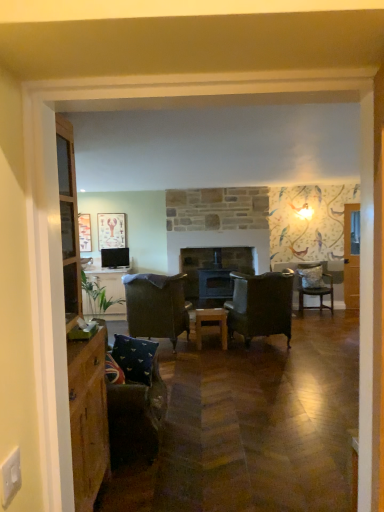
Question: Does wooden stove at center appear on the left side of blue fabric pillow at lower left?

Choices:
 (A) yes
 (B) no

Answer: (B)

Question: From the image's perspective, is wooden stove at center above blue fabric pillow at lower left?

Choices:
 (A) no
 (B) yes

Answer: (B)

Question: Is wooden stove at center in contact with blue fabric pillow at lower left?

Choices:
 (A) yes
 (B) no

Answer: (B)

Question: Is wooden stove at center far from blue fabric pillow at lower left?

Choices:
 (A) yes
 (B) no

Answer: (A)

Question: Is wooden stove at center positioned beyond the bounds of blue fabric pillow at lower left?

Choices:
 (A) no
 (B) yes

Answer: (B)

Question: Would you say velvet dark brown armchair at center, the second chair viewed from the front, is to the left or to the right of wooden stove at center in the picture?

Choices:
 (A) left
 (B) right

Answer: (A)

Question: From their relative heights in the image, would you say velvet dark brown armchair at center, which appears as the 3th chair when viewed from the right, is taller or shorter than wooden stove at center?

Choices:
 (A) short
 (B) tall

Answer: (A)

Question: Considering the positions of velvet dark brown armchair at center, which appears as the 3th chair when viewed from the right, and wooden stove at center in the image, is velvet dark brown armchair at center, which appears as the 3th chair when viewed from the right, bigger or smaller than wooden stove at center?

Choices:
 (A) big
 (B) small

Answer: (A)

Question: From a real-world perspective, is velvet dark brown armchair at center, which appears as the 3th chair when viewed from the right, positioned above or below wooden stove at center?

Choices:
 (A) above
 (B) below

Answer: (B)

Question: Is wooden table at center taller or shorter than velvet dark brown chair at right, the 3th chair when ordered from front to back?

Choices:
 (A) tall
 (B) short

Answer: (B)

Question: Is wooden table at center wider or thinner than velvet dark brown chair at right, the 3th chair when ordered from front to back?

Choices:
 (A) thin
 (B) wide

Answer: (A)

Question: From a real-world perspective, is wooden table at center positioned above or below velvet dark brown chair at right, the 3th chair when ordered from front to back?

Choices:
 (A) below
 (B) above

Answer: (A)

Question: Considering the positions of point (213, 309) and point (311, 280), is point (213, 309) closer or farther from the camera than point (311, 280)?

Choices:
 (A) farther
 (B) closer

Answer: (B)

Question: Does point (180, 304) appear closer or farther from the camera than point (82, 222)?

Choices:
 (A) farther
 (B) closer

Answer: (B)

Question: From a real-world perspective, is velvet dark brown armchair at center, the second chair viewed from the front, physically located above or below wooden picture frame at left, which is counted as the first picture frame, starting from the left?

Choices:
 (A) above
 (B) below

Answer: (B)